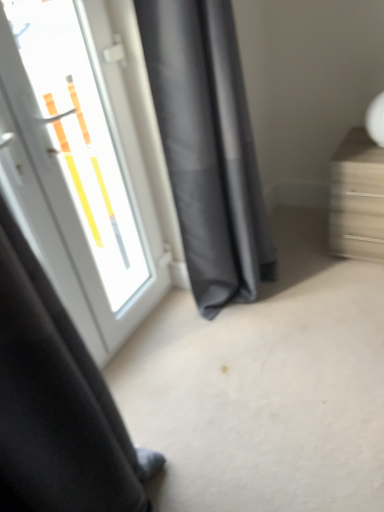
Question: Considering the relative sizes of wooden drawer at right and dark gray fabric curtain at center in the image provided, is wooden drawer at right shorter than dark gray fabric curtain at center?

Choices:
 (A) yes
 (B) no

Answer: (A)

Question: Is wooden drawer at right closer to the viewer compared to dark gray fabric curtain at center?

Choices:
 (A) no
 (B) yes

Answer: (A)

Question: Does wooden drawer at right appear on the left side of dark gray fabric curtain at center?

Choices:
 (A) no
 (B) yes

Answer: (A)

Question: Is wooden drawer at right outside of dark gray fabric curtain at center?

Choices:
 (A) no
 (B) yes

Answer: (B)

Question: Considering the relative positions of wooden drawer at right and dark gray fabric curtain at center in the image provided, is wooden drawer at right behind dark gray fabric curtain at center?

Choices:
 (A) yes
 (B) no

Answer: (A)

Question: Is wooden drawer at right aimed at dark gray fabric curtain at center?

Choices:
 (A) no
 (B) yes

Answer: (A)

Question: Does wooden drawer at right have a greater width compared to white glossy door at upper left?

Choices:
 (A) no
 (B) yes

Answer: (B)

Question: Is the depth of wooden drawer at right less than that of white glossy door at upper left?

Choices:
 (A) yes
 (B) no

Answer: (B)

Question: Is wooden drawer at right facing away from white glossy door at upper left?

Choices:
 (A) no
 (B) yes

Answer: (A)

Question: Is the position of wooden drawer at right more distant than that of white glossy door at upper left?

Choices:
 (A) no
 (B) yes

Answer: (B)

Question: From the image's perspective, is wooden drawer at right located above white glossy door at upper left?

Choices:
 (A) yes
 (B) no

Answer: (A)

Question: Is white glossy door at upper left completely or partially inside wooden drawer at right?

Choices:
 (A) yes
 (B) no

Answer: (B)

Question: Is white glossy door at upper left not near wooden drawer at right?

Choices:
 (A) no
 (B) yes

Answer: (B)